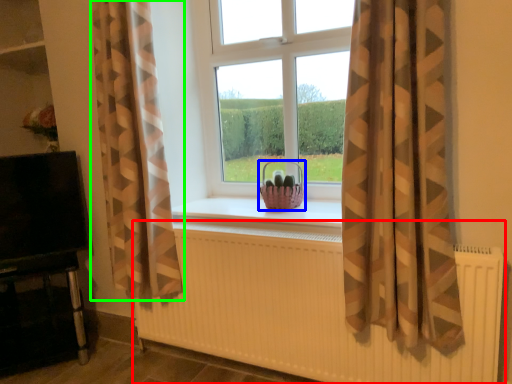
Question: Estimate the real-world distances between objects in this image. Which object is closer to radiator (highlighted by a red box), basket (highlighted by a blue box) or curtain (highlighted by a green box)?

Choices:
 (A) basket
 (B) curtain

Answer: (B)